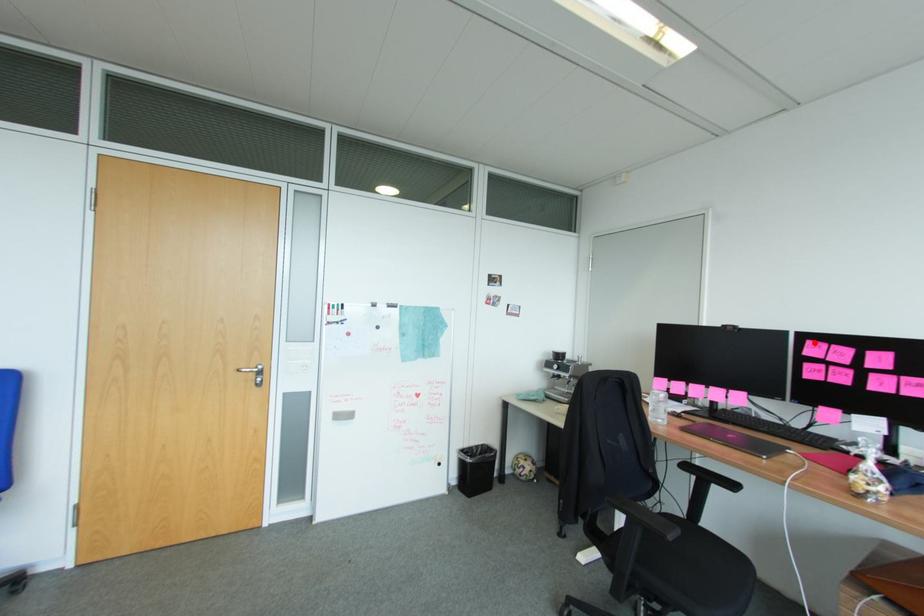
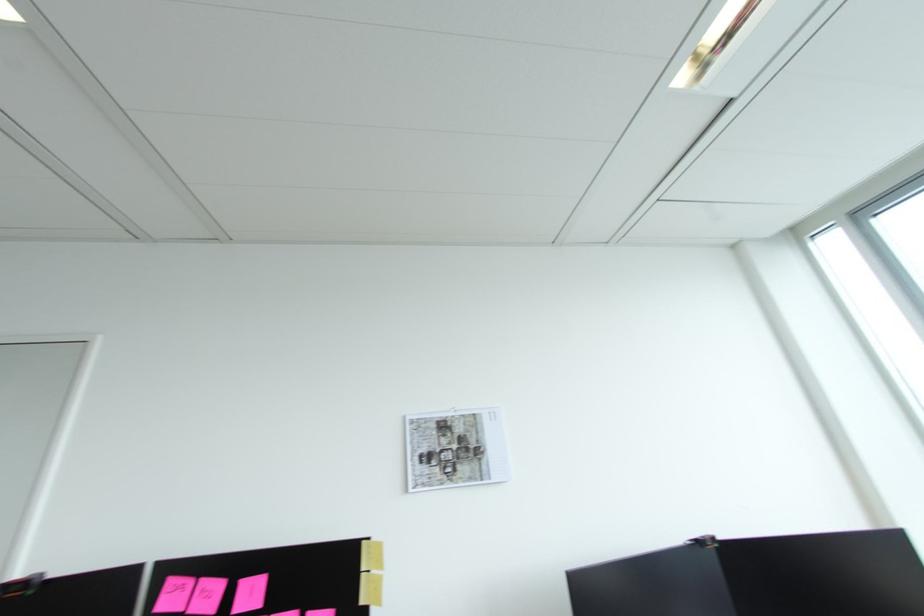
Where in the second image is the point corresponding to the highlighted location from the first image?

(176, 582)